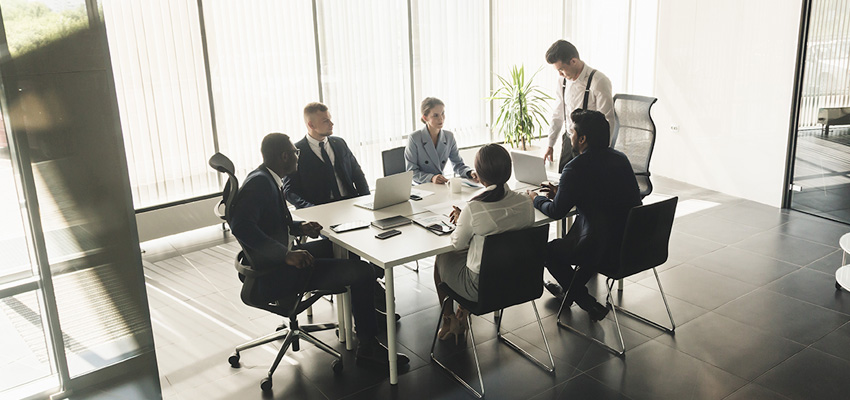
The height and width of the screenshot is (400, 850). Find the location of `window`. window is located at coordinates (187, 62), (265, 63), (335, 55), (450, 50), (518, 30), (595, 28), (826, 74), (13, 258).